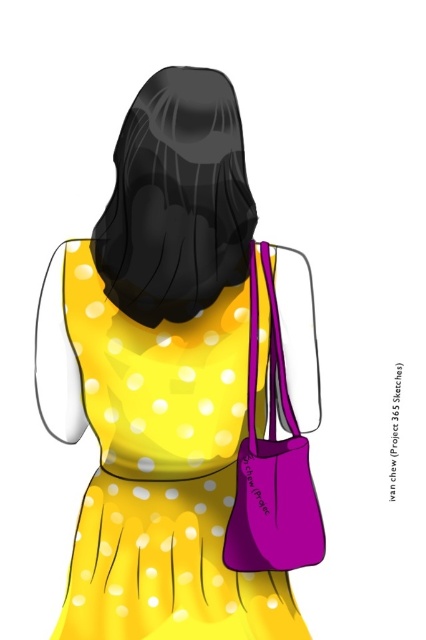
You are standing in front of a person wearing a yellow dress with white polka dots. The person is carrying a matte purple bag at lower right. If you want to hand them a small item without touching the bag, where should you place it?

You should place the item near the person but not near the matte purple bag at lower right, as the bag is 3.62 feet away from you, so keeping the item away from the bag ensures it won not be accidentally placed on or in the bag.

You are trying to decide which bag to choose based on height. The scene shows a person wearing a yellow dress and carrying two purple bags. One is a matte purple bag at lower right and the other is a purple matte bag at right. Which bag is taller?

The matte purple bag at lower right is much taller than the purple matte bag at right.